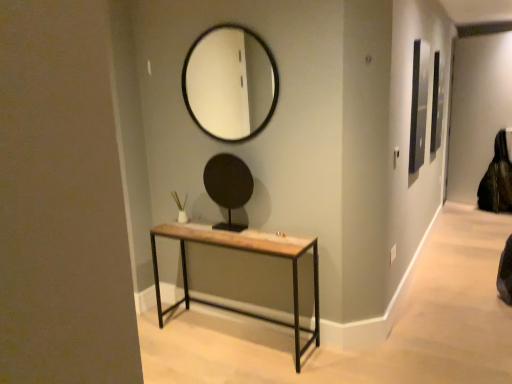
Question: Considering the relative sizes of rustic wood table at center and black leather swivel chair at right in the image provided, is rustic wood table at center bigger than black leather swivel chair at right?

Choices:
 (A) no
 (B) yes

Answer: (B)

Question: Is rustic wood table at center wider than black leather swivel chair at right?

Choices:
 (A) no
 (B) yes

Answer: (A)

Question: Can you confirm if rustic wood table at center is taller than black leather swivel chair at right?

Choices:
 (A) yes
 (B) no

Answer: (B)

Question: Considering the relative sizes of rustic wood table at center and black leather swivel chair at right in the image provided, is rustic wood table at center smaller than black leather swivel chair at right?

Choices:
 (A) no
 (B) yes

Answer: (A)

Question: Is rustic wood table at center shorter than black leather swivel chair at right?

Choices:
 (A) yes
 (B) no

Answer: (A)

Question: Is rustic wood table at center to the right of black leather swivel chair at right from the viewer's perspective?

Choices:
 (A) yes
 (B) no

Answer: (B)

Question: Is black matte mirror at center, which appears as the 2th mirror when viewed from the top, positioned before black glass mirror at upper center, the first mirror from the top?

Choices:
 (A) no
 (B) yes

Answer: (A)

Question: Is black matte mirror at center, marked as the first mirror in a bottom-to-top arrangement, positioned with its back to black glass mirror at upper center, which appears as the 2th mirror when ordered from the bottom?

Choices:
 (A) yes
 (B) no

Answer: (B)

Question: Is black matte mirror at center, which appears as the 2th mirror when viewed from the top, at the left side of black glass mirror at upper center, the first mirror from the top?

Choices:
 (A) yes
 (B) no

Answer: (B)

Question: Considering the relative sizes of black matte mirror at center, marked as the first mirror in a bottom-to-top arrangement, and black glass mirror at upper center, the first mirror from the top, in the image provided, is black matte mirror at center, marked as the first mirror in a bottom-to-top arrangement, smaller than black glass mirror at upper center, the first mirror from the top,?

Choices:
 (A) yes
 (B) no

Answer: (B)

Question: From the image's perspective, is black matte mirror at center, which appears as the 2th mirror when viewed from the top, beneath black glass mirror at upper center, which appears as the 2th mirror when ordered from the bottom?

Choices:
 (A) yes
 (B) no

Answer: (A)

Question: Could you tell me if black matte mirror at center, marked as the first mirror in a bottom-to-top arrangement, is turned towards black glass mirror at upper center, the first mirror from the top?

Choices:
 (A) yes
 (B) no

Answer: (B)

Question: Is black glass mirror at upper center, which appears as the 2th mirror when ordered from the bottom, positioned in front of rustic wood table at center?

Choices:
 (A) no
 (B) yes

Answer: (A)